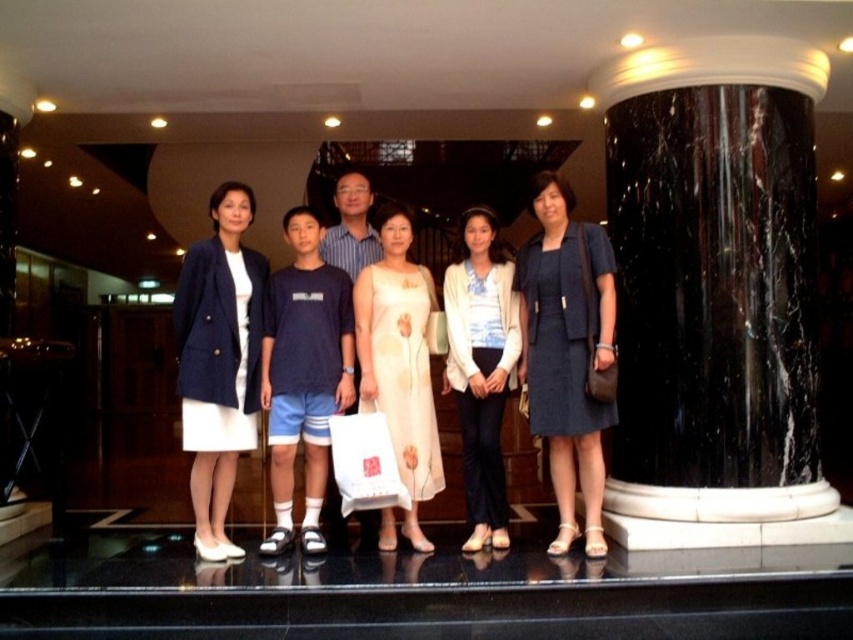
Who is taller, black marble pillar at right or white textured blazer at center?

With more height is black marble pillar at right.

Is black marble pillar at right further to the viewer compared to white textured blazer at center?

No, it is in front of white textured blazer at center.

You are a GUI agent. You are given a task and a screenshot of the screen. Output one action in this format:
    pyautogui.click(x=<x>, y=<y>)
    Task: Click on the black marble pillar at right
    The image size is (853, 640).
    Given the screenshot: What is the action you would take?
    pyautogui.click(x=715, y=294)

This screenshot has width=853, height=640. Find the location of `navy blue fabric skirt at center`. navy blue fabric skirt at center is located at coordinates (219, 360).

Is point (192, 394) positioned in front of point (469, 259)?

Yes, point (192, 394) is closer to viewer.

Is point (178, 396) more distant than point (468, 333)?

No, (178, 396) is closer to viewer.

Identify the location of navy blue fabric skirt at center. (219, 360).

Is light beige floral dress at center further to camera compared to white textured blazer at center?

No, light beige floral dress at center is in front of white textured blazer at center.

Measure the distance between light beige floral dress at center and white textured blazer at center.

light beige floral dress at center and white textured blazer at center are 32.04 centimeters apart from each other.

Measure the distance between point (x=378, y=333) and camera.

Point (x=378, y=333) and camera are 4.45 meters apart from each other.

Where is `light beige floral dress at center`? The image size is (853, 640). light beige floral dress at center is located at coordinates (399, 362).